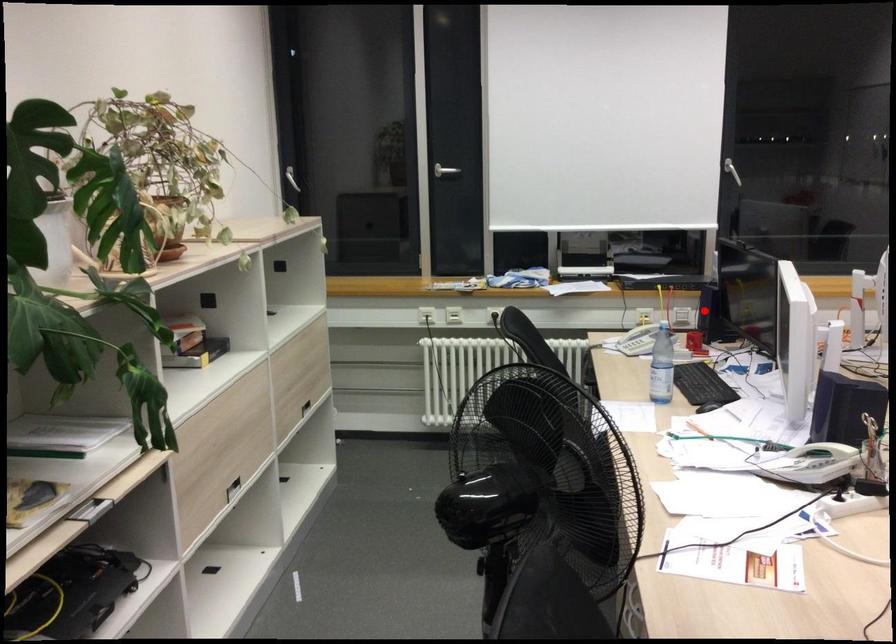
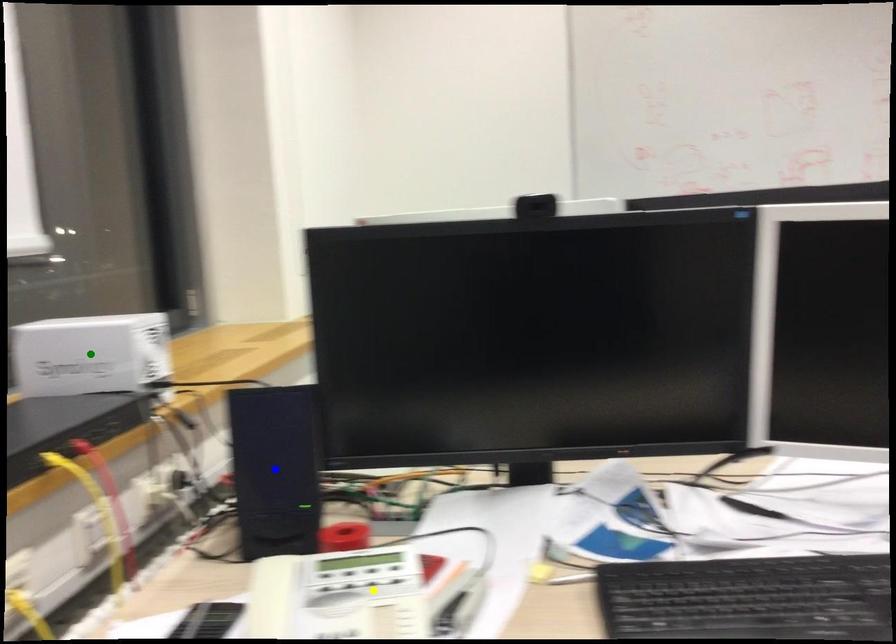
Question: I am providing you with two images of the same scene from different viewpoints. A red point is marked on the first image. You are given multiple points on the second image. Which mark in image 2 goes with the point in image 1?

Choices:
 (A) yellow point
 (B) green point
 (C) blue point

Answer: (C)